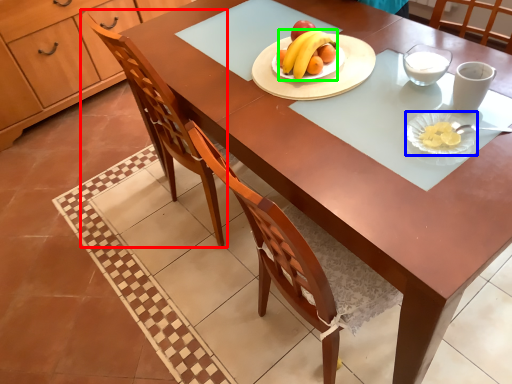
Question: Which object is the farthest from chair (highlighted by a red box)? Choose among these: platter (highlighted by a blue box) or banana (highlighted by a green box).

Choices:
 (A) platter
 (B) banana

Answer: (A)